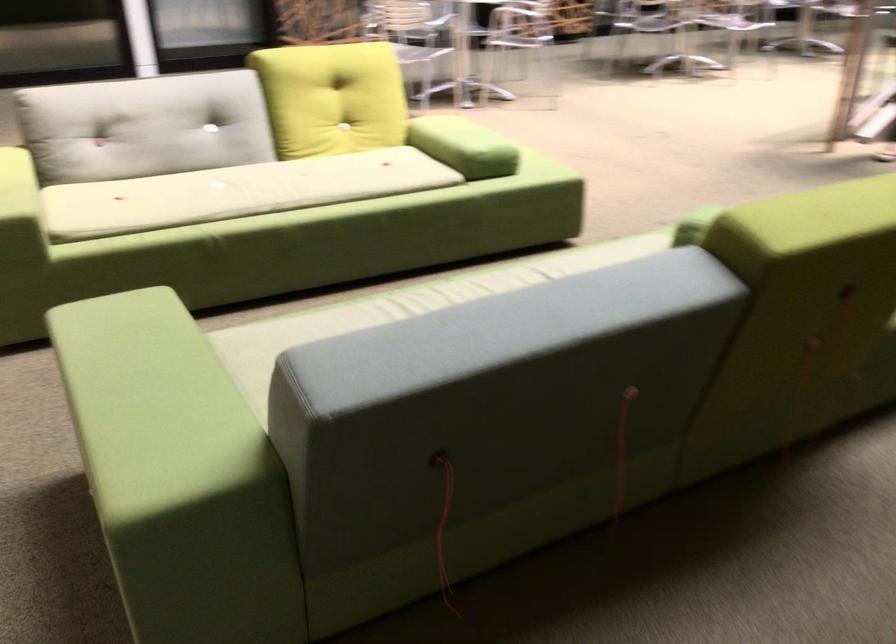
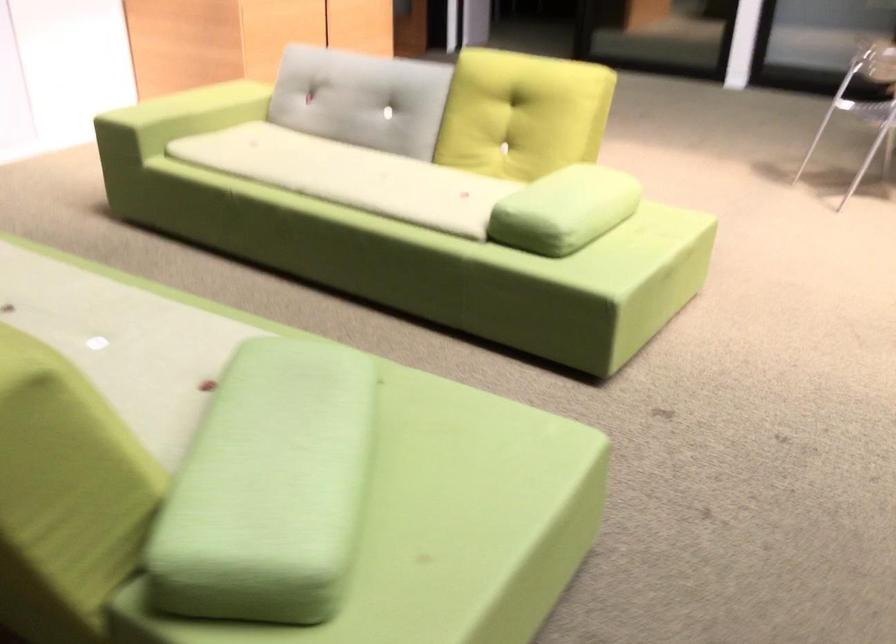
Where in the second image is the point corresponding to point 297,184 from the first image?

(349, 176)